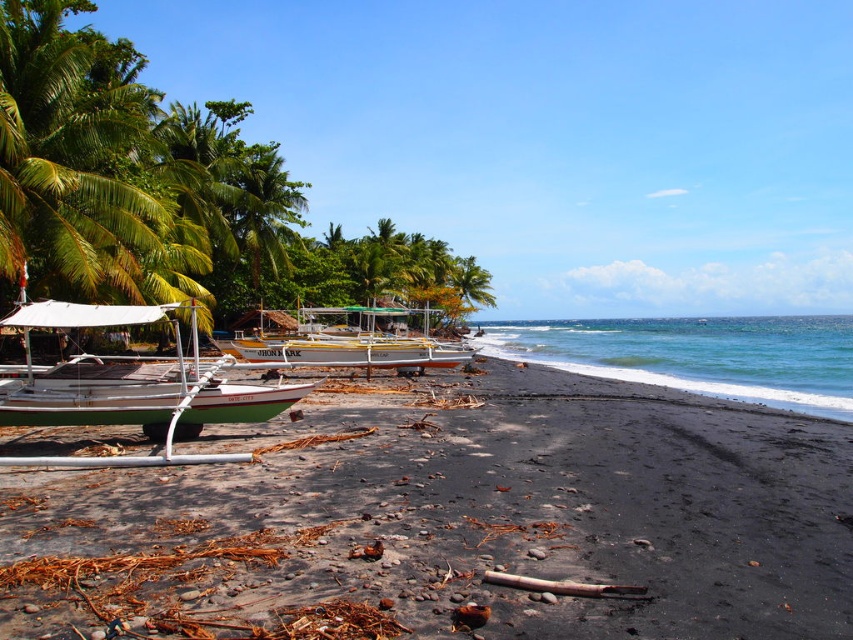
Can you confirm if green matte boat at left is positioned above green leafy palm tree at center?

Incorrect, green matte boat at left is not positioned above green leafy palm tree at center.

The image size is (853, 640). I want to click on green matte boat at left, so click(x=143, y=394).

Who is taller, blue-green water at lower right or green leafy palm tree at center?

green leafy palm tree at center

Is blue-green water at lower right closer to camera compared to green leafy palm tree at center?

Yes, blue-green water at lower right is in front of green leafy palm tree at center.

What do you see at coordinates (697, 355) in the screenshot? Image resolution: width=853 pixels, height=640 pixels. I see `blue-green water at lower right` at bounding box center [697, 355].

Where is `blue-green water at lower right`? The height and width of the screenshot is (640, 853). blue-green water at lower right is located at coordinates (697, 355).

Who is shorter, black sand at lower left or green matte boat at left?

black sand at lower left

Is black sand at lower left wider than green matte boat at left?

Yes.

What do you see at coordinates (454, 518) in the screenshot? I see `black sand at lower left` at bounding box center [454, 518].

This screenshot has height=640, width=853. I want to click on black sand at lower left, so click(x=454, y=518).